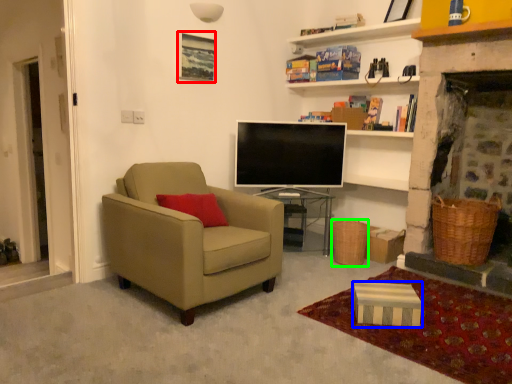
Question: Which object is positioned closest to picture frame (highlighted by a red box)? Select from box (highlighted by a blue box) and picnic basket (highlighted by a green box).

Choices:
 (A) box
 (B) picnic basket

Answer: (B)